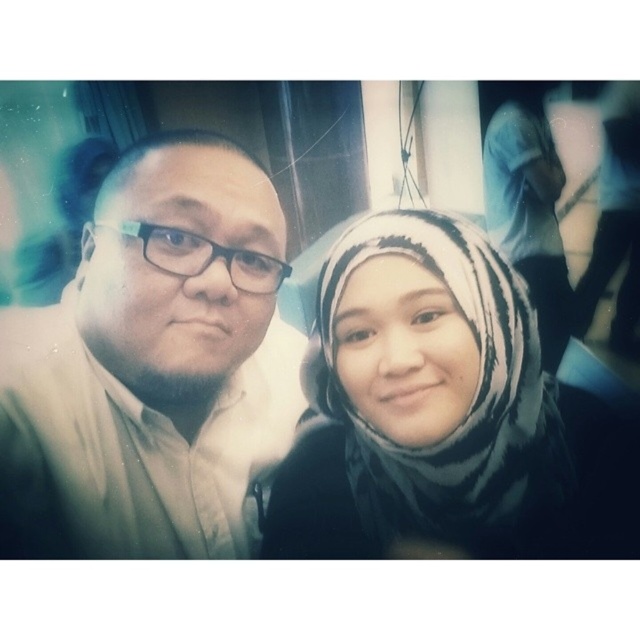
You are taking a photo with two friends. You want to ensure that both the matte beige shirt at left and the white striped scarf at upper right are clearly visible in the frame. Based on their positions, which friend should you position closer to the center of the camera to avoid blurring?

The white striped scarf at upper right should be positioned closer to the center of the camera because the matte beige shirt at left is to the left of it, so moving the scarf towards the center will help keep both in focus.

You are a photographer trying to capture a closeup shot of both the matte black shirt at center and the black and white patterned hijab at center in the image. Given that your camera has a depth of field that can sharply focus on objects within a 3 inch range, will both items be in focus simultaneously?

The matte black shirt at center and the black and white patterned hijab at center are 2.99 inches apart from each other. Since the distance between them is within the 3 inch range of the camera, both items will be in focus simultaneously.

You are standing in the room where the selfie was taken. You want to move from the point at coordinates point (x=285, y=531) to the point at coordinates point (x=518, y=157). Can you walk directly between them without any obstacles?

Point (x=285, y=531) is behind point (x=518, y=157), so you cannot walk directly between them without passing through the point at (x=518, y=157) first.